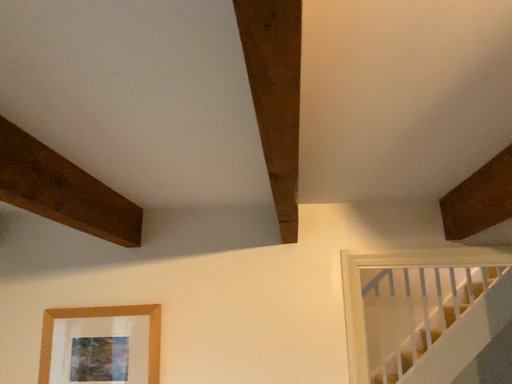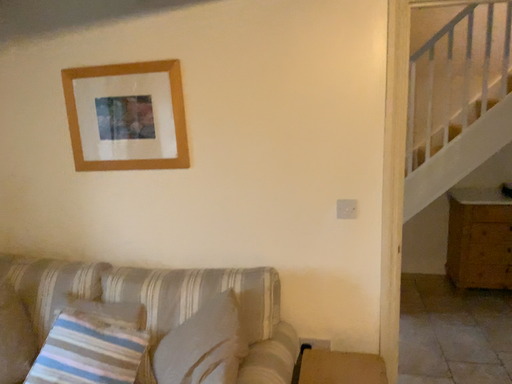
Question: How did the camera likely rotate when shooting the video?

Choices:
 (A) rotated downward
 (B) rotated upward

Answer: (A)